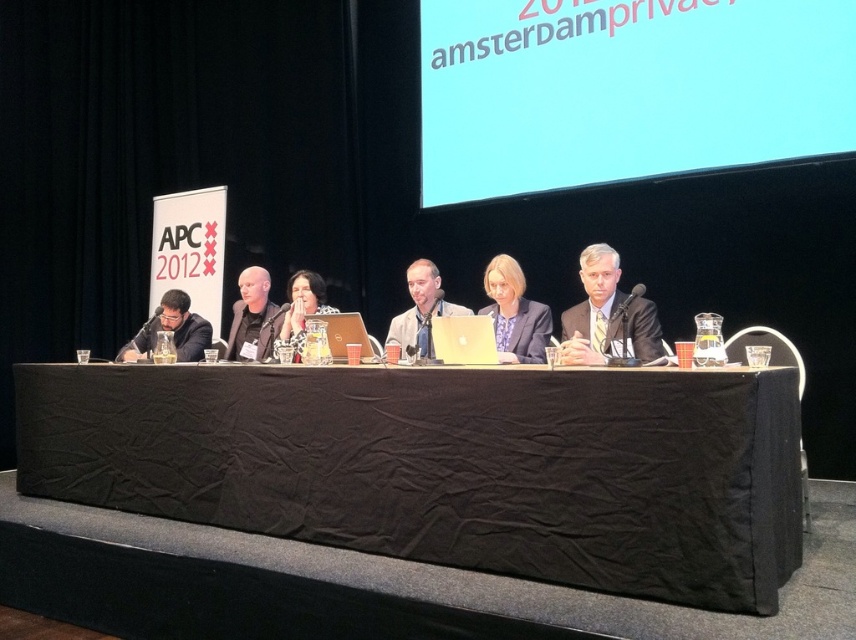
Does black fabric table at center have a greater height compared to matte black laptop at center?

Result: Yes, black fabric table at center is taller than matte black laptop at center.

Is black fabric table at center positioned before matte black laptop at center?

Yes, black fabric table at center is closer to the viewer.

You are a GUI agent. You are given a task and a screenshot of the screen. Output one action in this format:
    pyautogui.click(x=<x>, y=<y>)
    Task: Click on the black fabric table at center
    The width and height of the screenshot is (856, 640).
    Given the screenshot: What is the action you would take?
    pyautogui.click(x=447, y=465)

At what (x,y) coordinates should I click in order to perform the action: click on matte gray suit at center. Please return your answer as a coordinate pair (x, y). Looking at the image, I should click on (608, 316).

Between matte gray suit at center and matte black laptop at left, which one is positioned higher?

matte gray suit at center is above.

Locate an element on the screen. This screenshot has height=640, width=856. matte gray suit at center is located at coordinates (608, 316).

Does point (391, 387) come closer to viewer compared to point (325, 314)?

Yes, it is in front of point (325, 314).

Can you confirm if black fabric table at center is shorter than metallic silver laptop at center?

No.

The image size is (856, 640). Describe the element at coordinates (447, 465) in the screenshot. I see `black fabric table at center` at that location.

You are a GUI agent. You are given a task and a screenshot of the screen. Output one action in this format:
    pyautogui.click(x=<x>, y=<y>)
    Task: Click on the black fabric table at center
    The width and height of the screenshot is (856, 640).
    Given the screenshot: What is the action you would take?
    pyautogui.click(x=447, y=465)